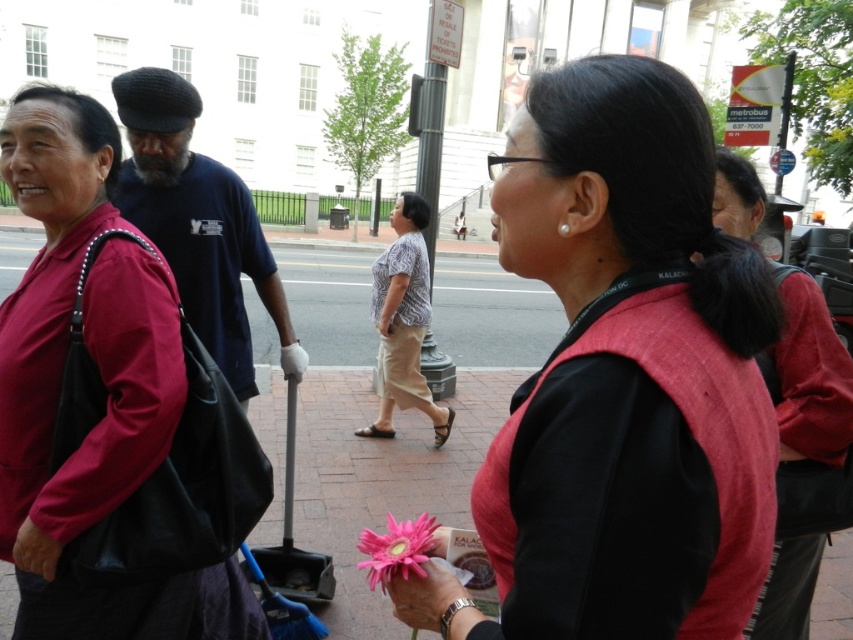
Question: Which object is closer to the camera taking this photo?

Choices:
 (A) pink fabric flower at center
 (B) matte black bag at left
 (C) pink matte flower at lower center

Answer: (A)

Question: Is pink fabric flower at center to the right of pink matte flower at lower center from the viewer's perspective?

Choices:
 (A) no
 (B) yes

Answer: (B)

Question: Estimate the real-world distances between objects in this image. Which object is closer to the pink fabric flower at center?

Choices:
 (A) pink matte flower at lower center
 (B) matte black bag at left

Answer: (A)

Question: Based on their relative distances, which object is nearer to the pink matte flower at lower center?

Choices:
 (A) pink fabric flower at center
 (B) matte black bag at left

Answer: (A)

Question: Does pink fabric flower at center appear on the left side of pink matte flower at lower center?

Choices:
 (A) yes
 (B) no

Answer: (B)

Question: Is pink fabric flower at center positioned in front of matte black bag at left?

Choices:
 (A) no
 (B) yes

Answer: (B)